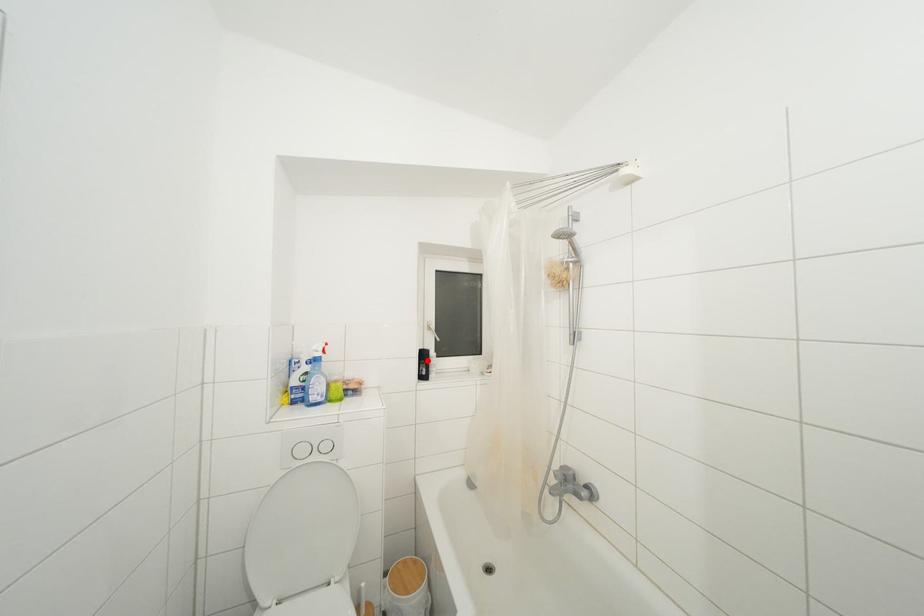
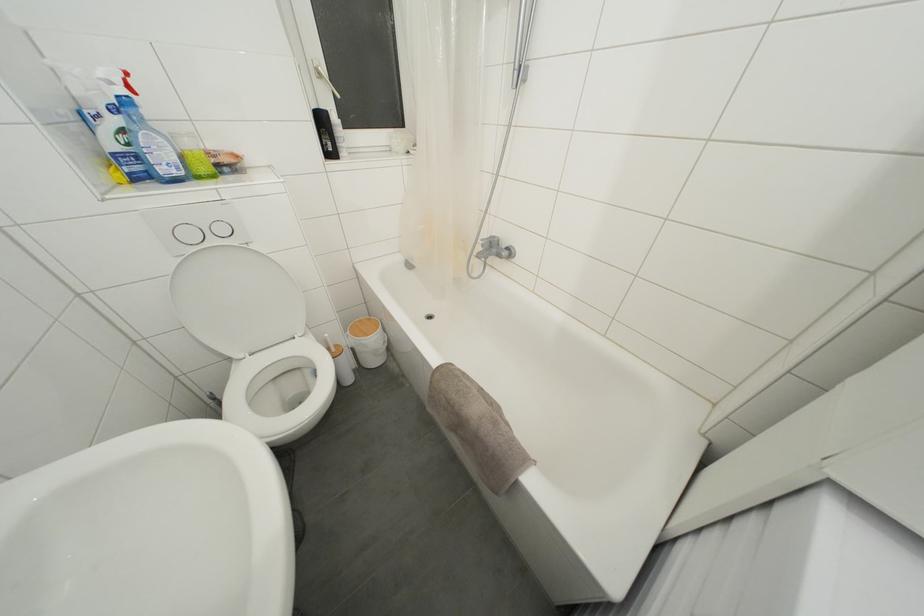
Question: I am providing you with two images of the same scene from different viewpoints. Image1 has a red point marked. In image2, the corresponding 3D location appears at what relative position? Reply with the corresponding letter.

Choices:
 (A) Closer
 (B) Farther

Answer: (A)